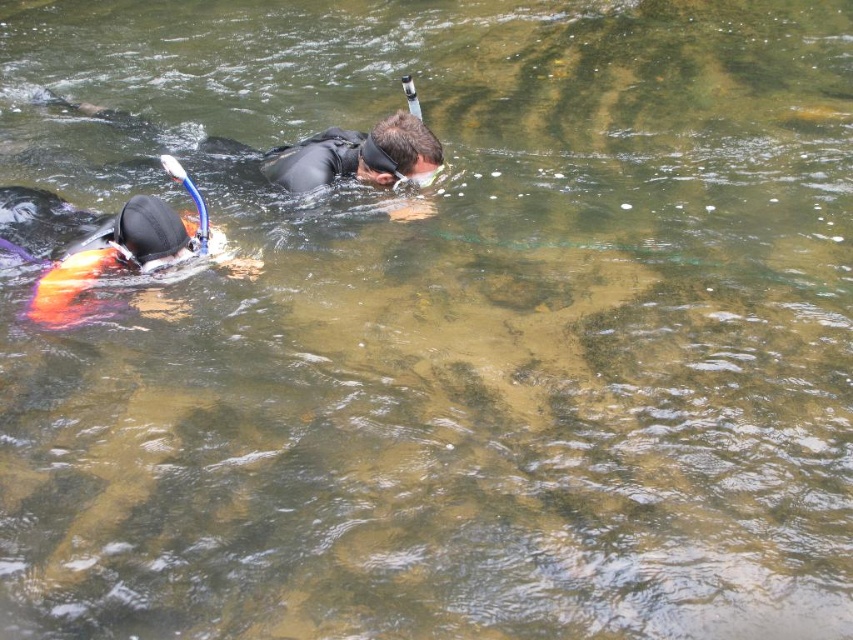
You are a drone operator trying to locate the black matte wetsuit at center in the image. The coordinates provided are point A at [345,156]. Can you confirm if point A matches the location of the black matte wetsuit at center?

Yes, point A at [345,156] corresponds to the black matte wetsuit at center as stated in the Objects Description.